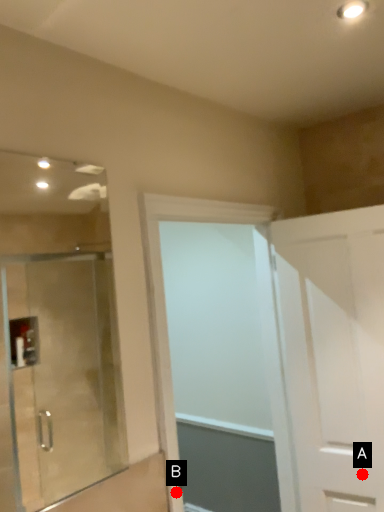
Question: Two points are circled on the image, labeled by A and B beside each circle. Which point appears closest to the camera in this image?

Choices:
 (A) A is closer
 (B) B is closer

Answer: (B)